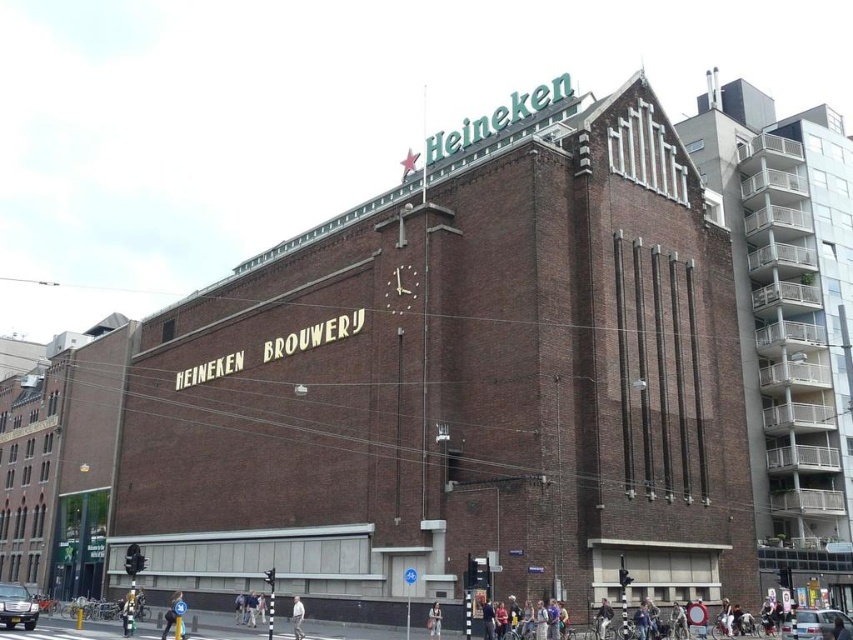
Question: Is light blue jeans at center smaller than dark blue jeans at lower left?

Choices:
 (A) yes
 (B) no

Answer: (A)

Question: Is light blue jeans at center to the right of light brown leather jacket at lower center from the viewer's perspective?

Choices:
 (A) yes
 (B) no

Answer: (A)

Question: Which of the following is the closest to the observer?

Choices:
 (A) (438, 625)
 (B) (170, 600)

Answer: (A)

Question: Considering the real-world distances, which object is closest to the skinny jeans at lower center?

Choices:
 (A) light blue jeans at center
 (B) light brown leather jacket at lower center
 (C) dark blue jeans at lower left

Answer: (C)

Question: Which point is farther from the camera taking this photo?

Choices:
 (A) (125, 632)
 (B) (180, 636)

Answer: (A)

Question: Does light blue jeans at center appear on the right side of light brown leather jacket at lower center?

Choices:
 (A) no
 (B) yes

Answer: (B)